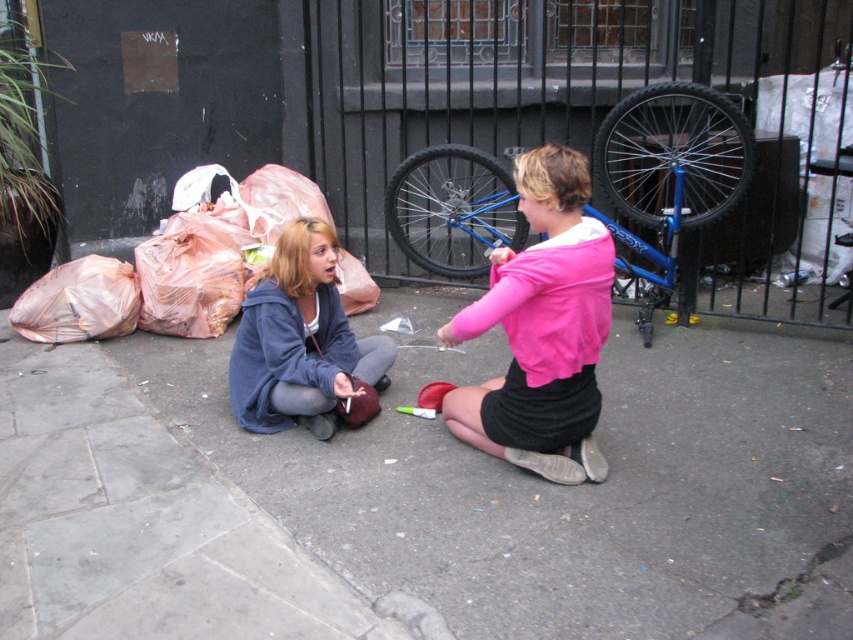
Question: Considering the relative positions of plastic bags at lower left and matte blue hoodie at center in the image provided, where is plastic bags at lower left located with respect to matte blue hoodie at center?

Choices:
 (A) above
 (B) below

Answer: (A)

Question: Estimate the real-world distances between objects in this image. Which object is farther from the concrete pavement at center?

Choices:
 (A) pink matte shirt at center
 (B) matte blue hoodie at center

Answer: (A)

Question: Can you confirm if blue metallic bicycle at upper center is bigger than matte blue hoodie at center?

Choices:
 (A) no
 (B) yes

Answer: (B)

Question: Among these objects, which one is farthest from the camera?

Choices:
 (A) blue metallic bicycle at upper center
 (B) matte blue hoodie at center

Answer: (A)

Question: Which of the following is the farthest from the observer?

Choices:
 (A) concrete pavement at center
 (B) plastic bags at lower left
 (C) matte blue hoodie at center
 (D) blue metallic bicycle at upper center

Answer: (B)

Question: Observing the image, what is the correct spatial positioning of concrete pavement at center in reference to plastic bags at lower left?

Choices:
 (A) left
 (B) right

Answer: (B)